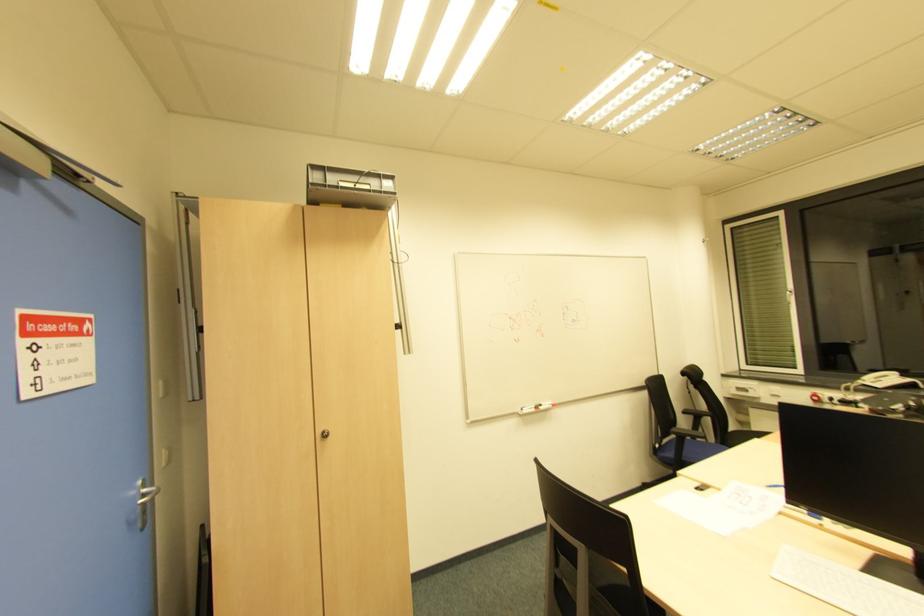
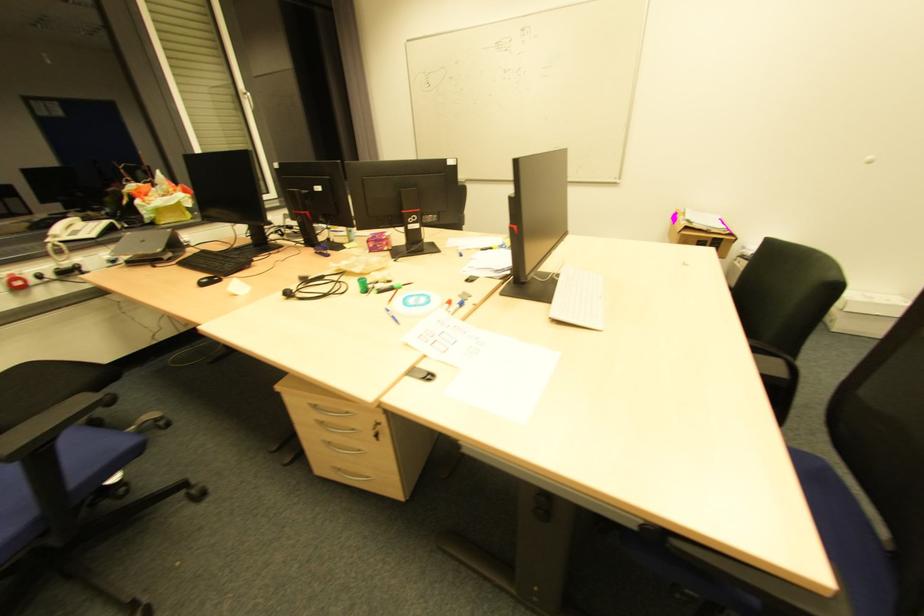
Find the pixel in the second image that matches the point at 685,439 in the first image.

(51, 440)